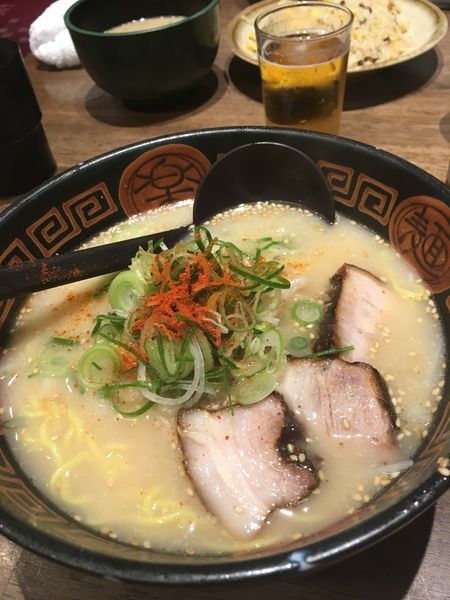
Locate an element on the screen. bowl of soup is located at coordinates (145, 24).